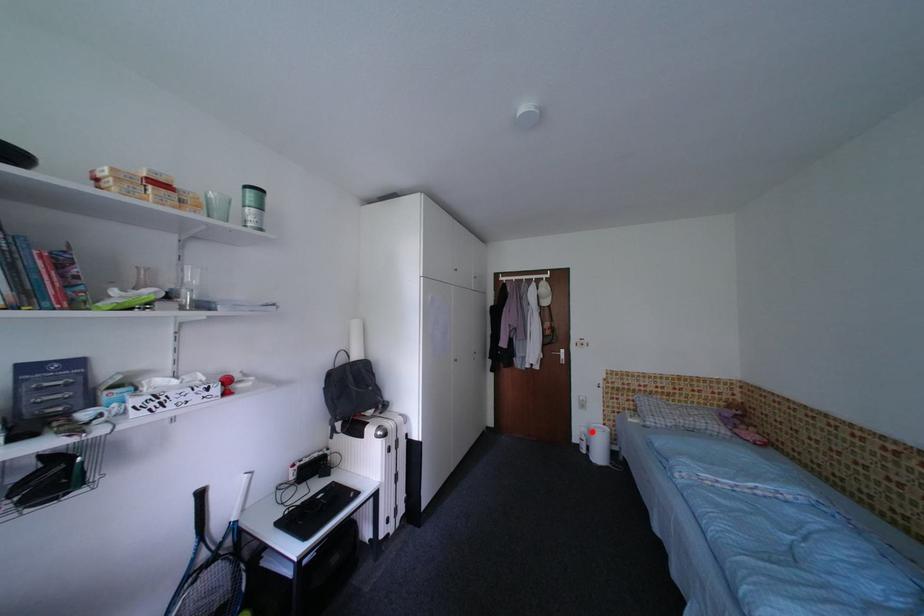
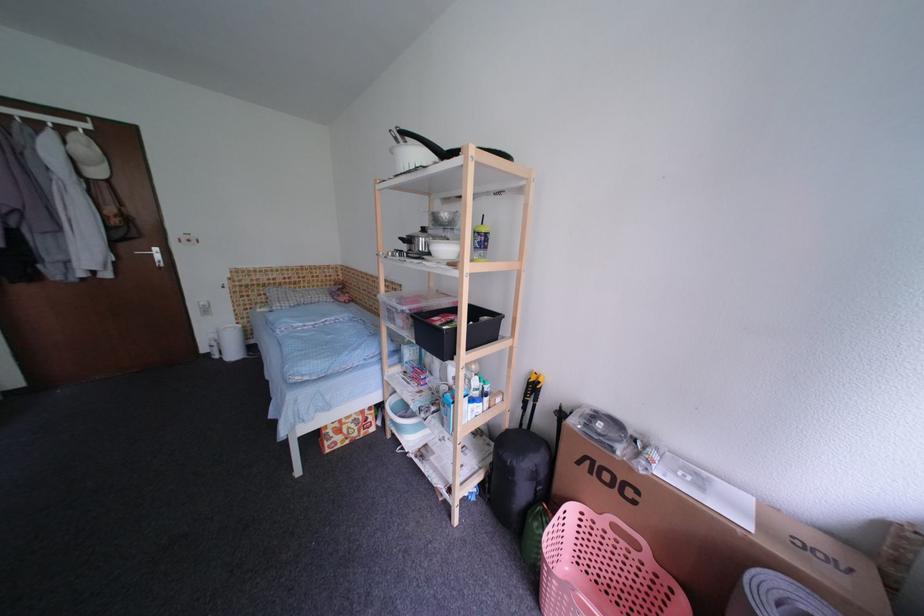
In the second image, find the point that corresponds to the highlighted location in the first image.

(222, 338)